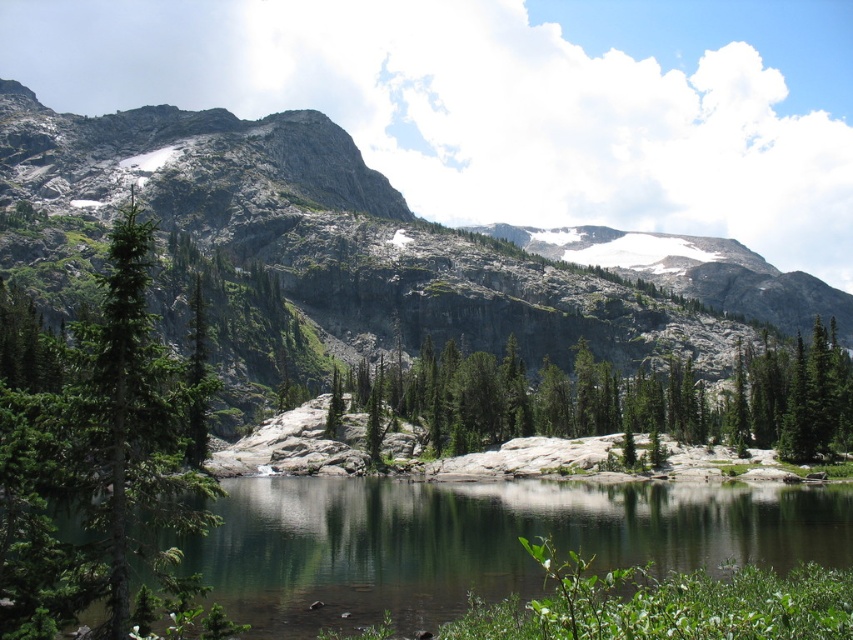
Based on the photo, who is lower down, granite rock formation at center or green textured rock at center?

Positioned lower is green textured rock at center.

Which is above, granite rock formation at center or green textured rock at center?

granite rock formation at center is above.

Between point (544, 268) and point (521, 412), which one is positioned behind?

The point (544, 268) is more distant.

Image resolution: width=853 pixels, height=640 pixels. In order to click on granite rock formation at center in this screenshot , I will do `click(390, 236)`.

Which of these two, granite rock formation at center or green matte tree at left, stands taller?

Standing taller between the two is granite rock formation at center.

How much distance is there between granite rock formation at center and green matte tree at left?

granite rock formation at center is 129.30 meters from green matte tree at left.

Locate an element on the screen. granite rock formation at center is located at coordinates (390, 236).

Who is lower down, green matte tree at left or green textured rock at center?

green textured rock at center is lower down.

Between green matte tree at left and green textured rock at center, which one has more height?

Standing taller between the two is green matte tree at left.

Find the location of `green matte tree at left`. green matte tree at left is located at coordinates (97, 456).

The height and width of the screenshot is (640, 853). What are the coordinates of `green matte tree at left` in the screenshot? It's located at (97, 456).